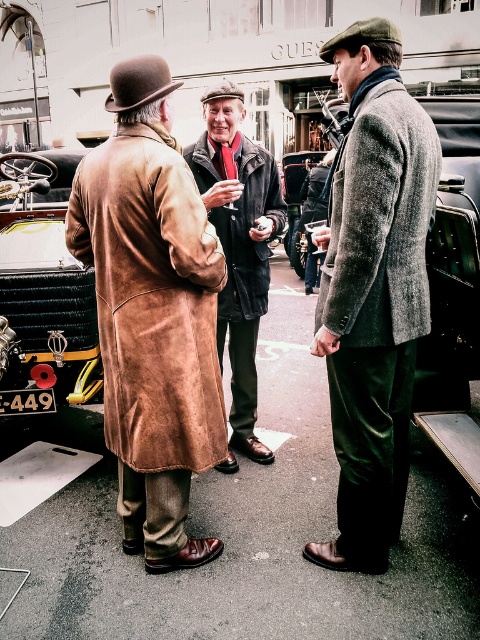
Question: Does brown suede trench coat at left appear under black plastic license plate at center?

Choices:
 (A) no
 (B) yes

Answer: (A)

Question: Which object is positioned closest to the black plastic license plate at center?

Choices:
 (A) black leather car at left
 (B) textured gray coat at center

Answer: (A)

Question: Which object is farther from the camera taking this photo?

Choices:
 (A) black leather car at left
 (B) textured gray coat at center
 (C) brown suede trench coat at left

Answer: (A)

Question: Is textured gray coat at center bigger than black leather car at left?

Choices:
 (A) yes
 (B) no

Answer: (B)

Question: Among these objects, which one is farthest from the camera?

Choices:
 (A) black leather car at left
 (B) gray wool coat at center
 (C) brown suede trench coat at left

Answer: (A)

Question: Does black leather car at left have a greater width compared to velvet black coat at center?

Choices:
 (A) yes
 (B) no

Answer: (A)